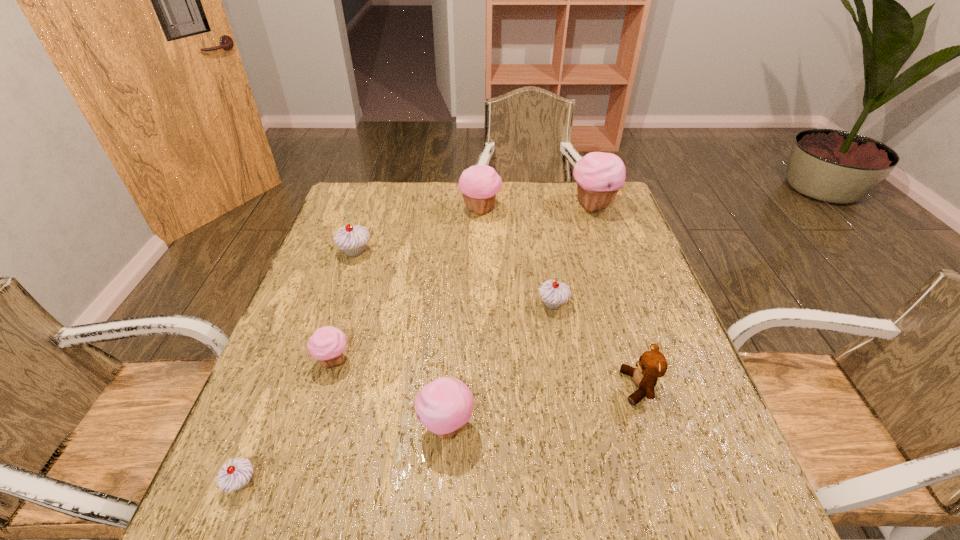
Locate an element on the screen. Image resolution: width=960 pixels, height=540 pixels. vacant space at the near edge of the desktop is located at coordinates (662, 539).

At what (x,y) coordinates should I click in order to perform the action: click on vacant point at the left edge. Please return your answer as a coordinate pair (x, y). Image resolution: width=960 pixels, height=540 pixels. Looking at the image, I should click on (312, 292).

The width and height of the screenshot is (960, 540). In the image, there is a desktop. Identify the location of vacant region at the right edge. (599, 273).

The width and height of the screenshot is (960, 540). In the image, there is a desktop. In order to click on vacant area at the far left corner in this screenshot , I will do `click(391, 185)`.

Locate an element on the screen. Image resolution: width=960 pixels, height=540 pixels. vacant space at the far right corner of the desktop is located at coordinates (615, 203).

I want to click on free space between the second biggest pink cupcake and the tallest cupcake, so click(x=537, y=208).

Find the location of a particular element. vacant region between the biggest pink cupcake and the nearest pink cupcake is located at coordinates (519, 316).

The width and height of the screenshot is (960, 540). Identify the location of unoccupied area between the teddy bear and the leftmost pink cupcake. (486, 374).

Identify the location of vacant region between the brown teddy bear and the third biggest pink cupcake. [542, 407].

This screenshot has width=960, height=540. I want to click on vacant point located between the tallest cupcake and the brown teddy bear, so click(616, 296).